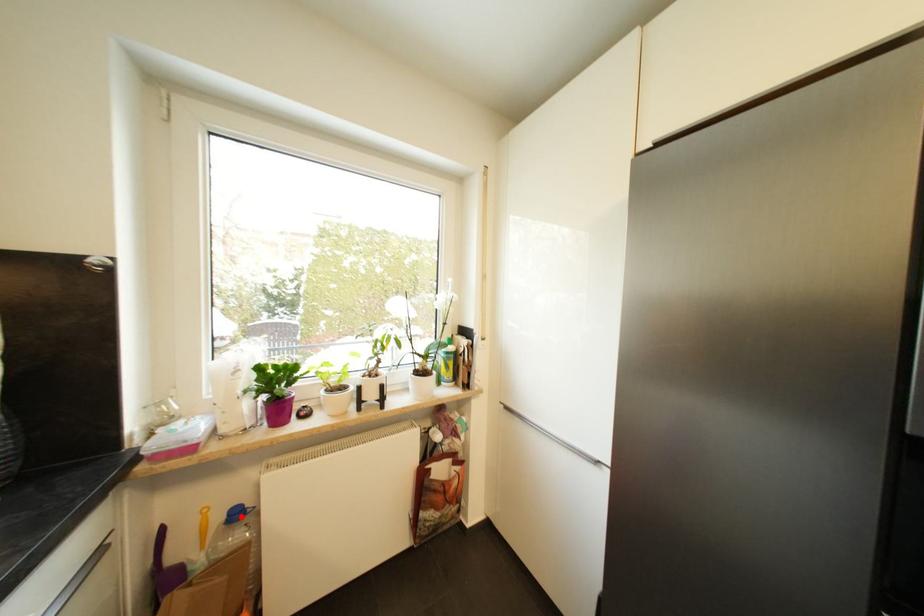
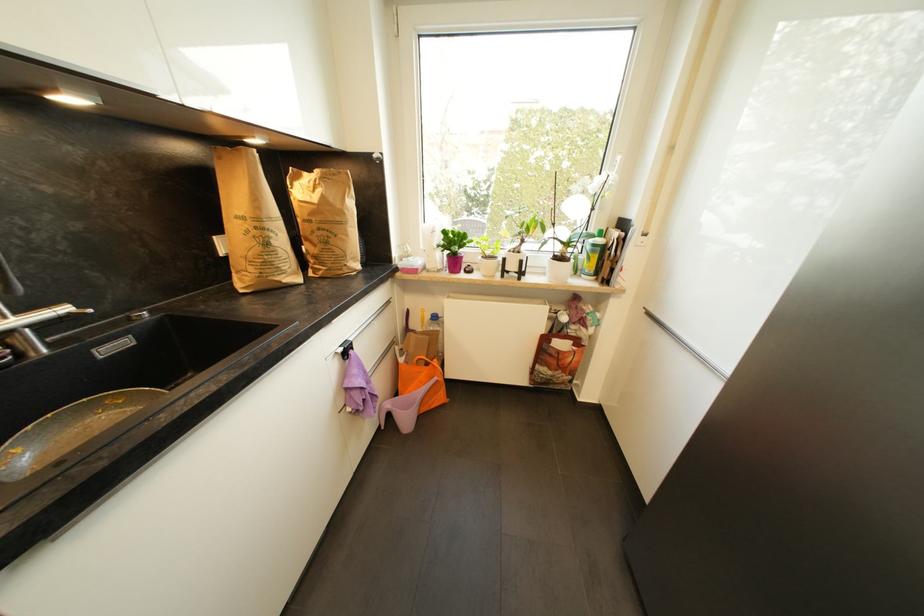
In the second image, find the point that corresponds to the highlighted location in the first image.

(440, 320)